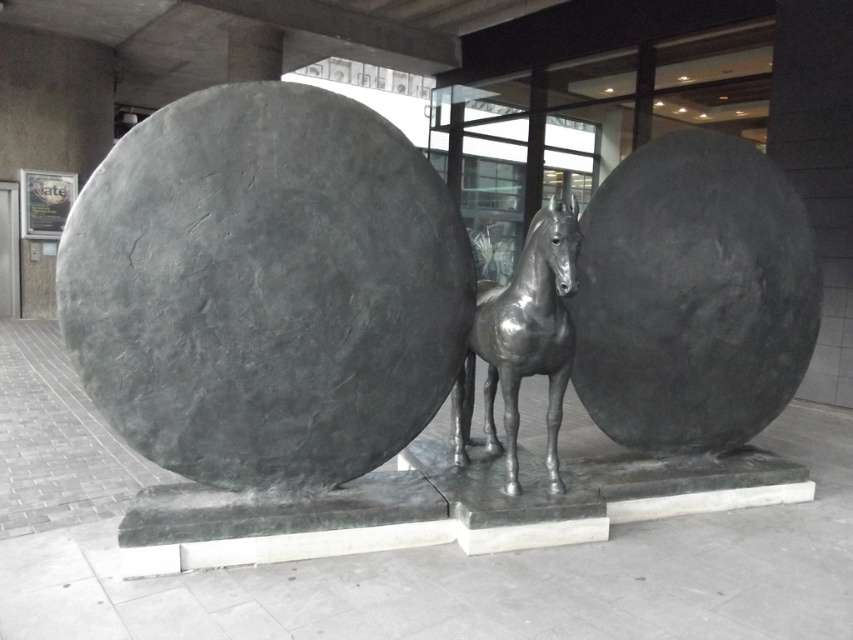
Can you confirm if bronze horse at center is shorter than polished bronze horse at center?

In fact, bronze horse at center may be taller than polished bronze horse at center.

Is point (459, 221) in front of point (537, 269)?

That is False.

Between point (438, 236) and point (496, 362), which one is positioned in front?

Point (438, 236) is in front.

Image resolution: width=853 pixels, height=640 pixels. In order to click on bronze horse at center in this screenshot , I will do `click(264, 288)`.